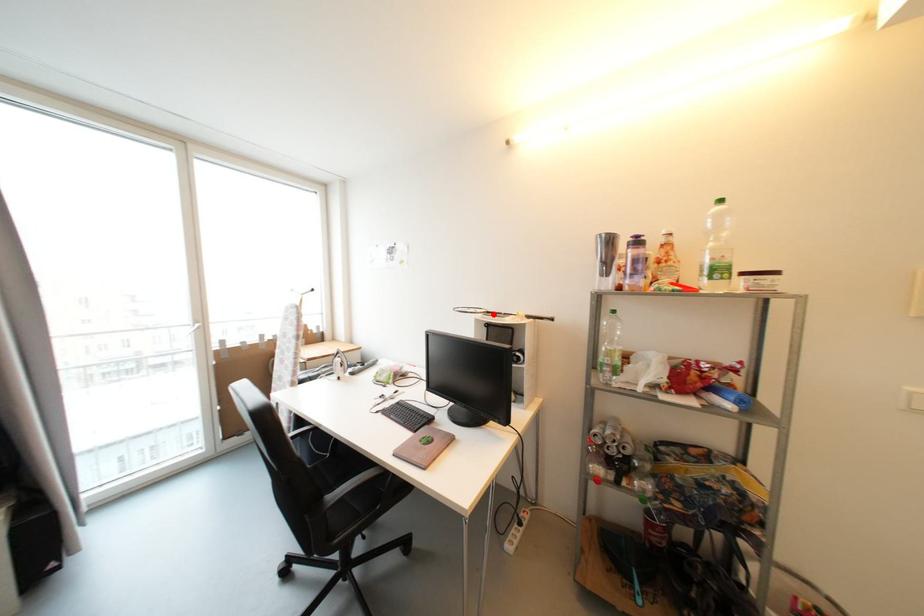
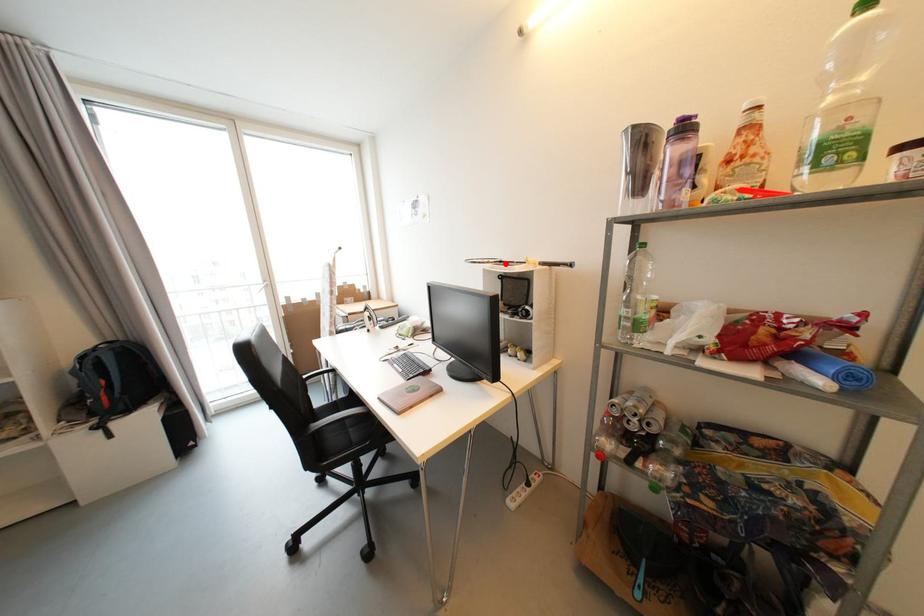
I am providing you with two images of the same scene from different viewpoints. A red point is marked on the first image and another point is marked on the second image. Is the marked point in image1 the same physical position as the marked point in image2?

Yes